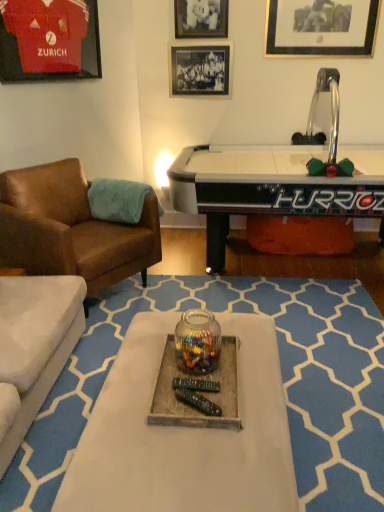
Where is `vacant area that lies to the right of black plastic remote control at center, the 1th remote control from the back`? Image resolution: width=384 pixels, height=512 pixels. vacant area that lies to the right of black plastic remote control at center, the 1th remote control from the back is located at coordinates (226, 388).